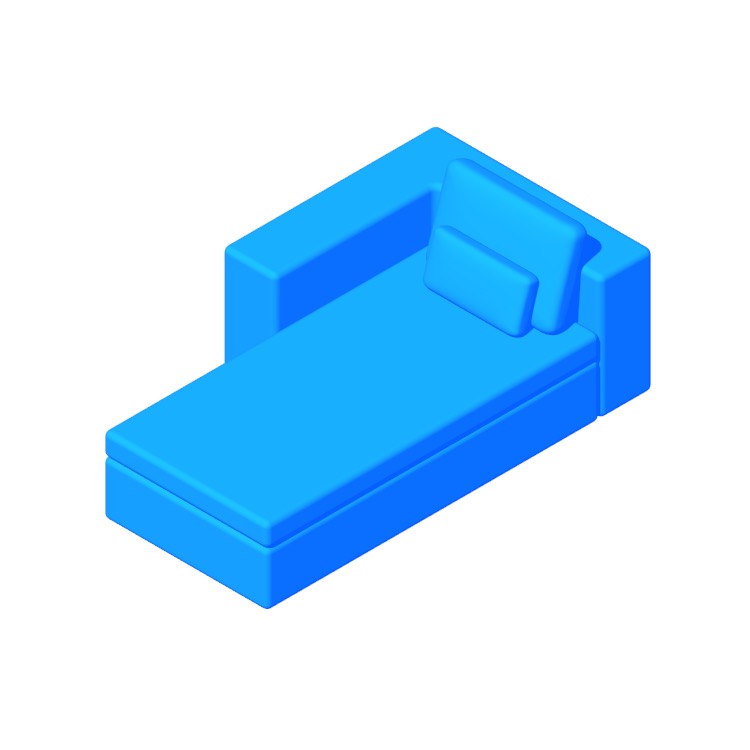
This screenshot has height=750, width=750. Find the location of `large pillow`. large pillow is located at coordinates (523, 248).